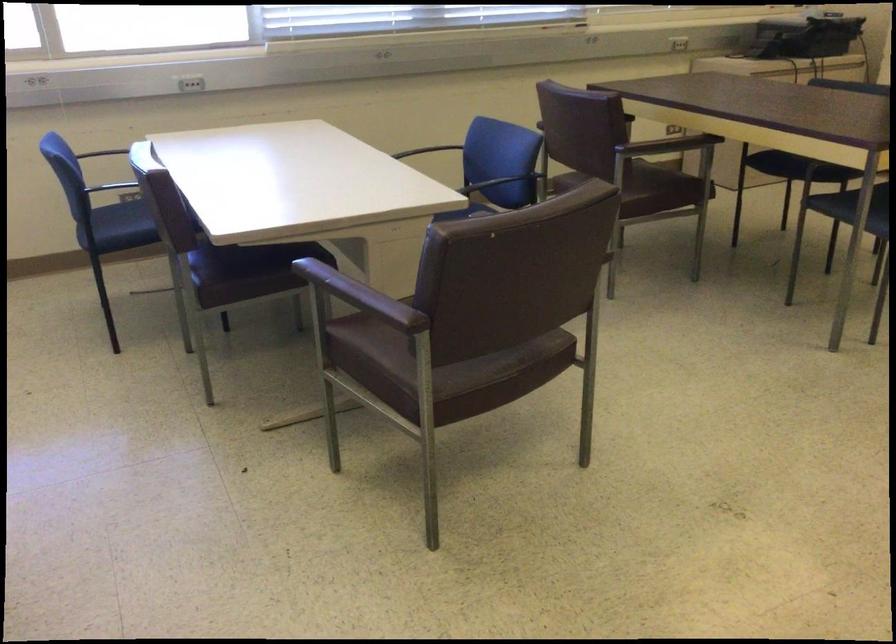
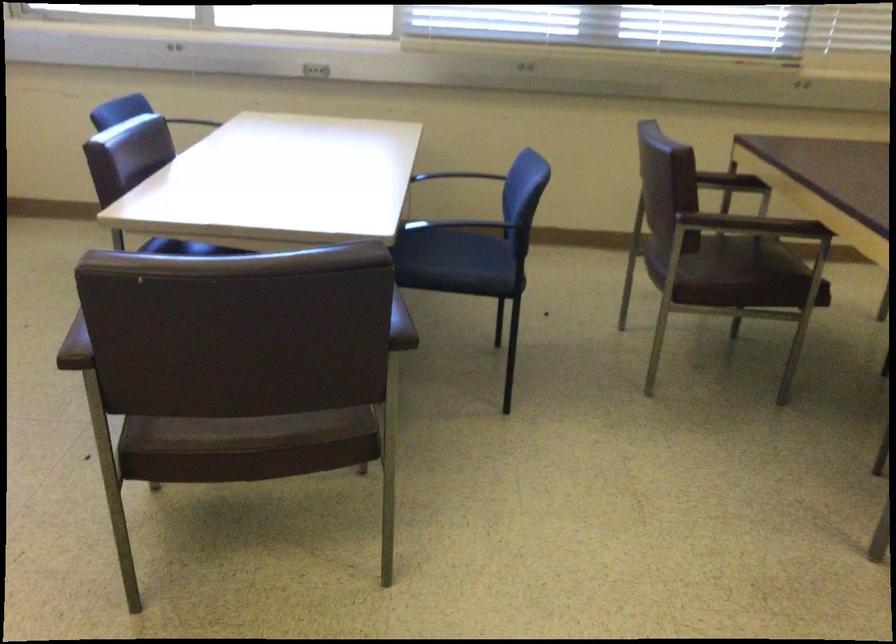
Where in the second image is the point corresponding to point (85, 152) from the first image?

(202, 120)